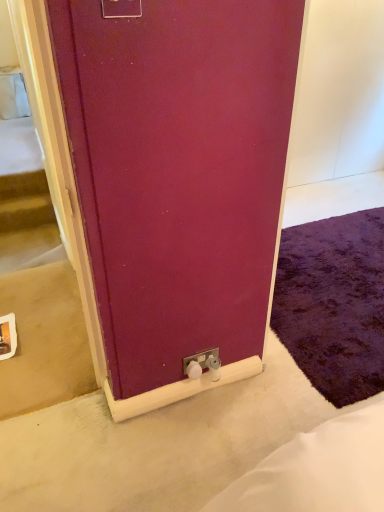
Question: In terms of height, does matte plastic electric outlet at upper center, positioned as the second electric outlet in back-to-front order, look taller or shorter compared to purple shaggy rug at lower right?

Choices:
 (A) short
 (B) tall

Answer: (B)

Question: Considering their positions, is matte plastic electric outlet at upper center, marked as the first electric outlet in a top-to-bottom arrangement, located in front of or behind purple shaggy rug at lower right?

Choices:
 (A) front
 (B) behind

Answer: (A)

Question: Estimate the real-world distances between objects in this image. Which object is closer to the white plastic electric outlet at lower center, which ranks as the 2th electric outlet in front-to-back order?

Choices:
 (A) purple shaggy rug at lower right
 (B) matte plastic electric outlet at upper center, marked as the first electric outlet in a top-to-bottom arrangement

Answer: (A)

Question: Estimate the real-world distances between objects in this image. Which object is farther from the white plastic electric outlet at lower center, placed as the 1th electric outlet when sorted from back to front?

Choices:
 (A) purple shaggy rug at lower right
 (B) matte plastic electric outlet at upper center, acting as the 2th electric outlet starting from the right

Answer: (B)